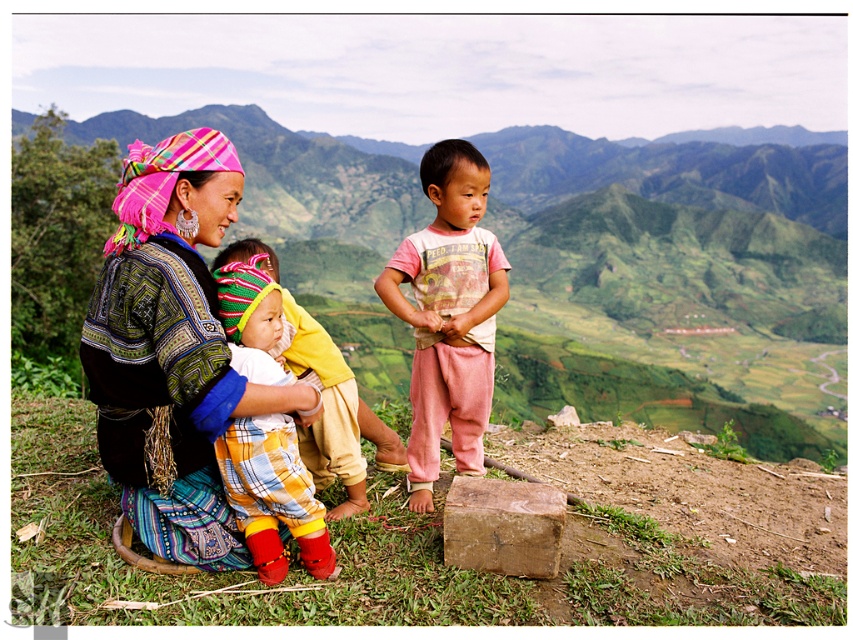
Which is above, matte black dress at center or pink cotton pants at center?

pink cotton pants at center

What do you see at coordinates (172, 352) in the screenshot? The image size is (853, 640). I see `matte black dress at center` at bounding box center [172, 352].

Image resolution: width=853 pixels, height=640 pixels. I want to click on matte black dress at center, so click(172, 352).

Is pink cotton pants at center thinner than brown rough stone at lower center?

No, pink cotton pants at center is not thinner than brown rough stone at lower center.

Does point (409, 456) lie in front of point (553, 566)?

No, it is not.

This screenshot has height=640, width=853. I want to click on pink cotton pants at center, so click(x=448, y=312).

In the scene shown: Which of these two, matte black dress at center or knitted woolen hat at center, stands taller?

Standing taller between the two is matte black dress at center.

Between matte black dress at center and knitted woolen hat at center, which one has less height?

knitted woolen hat at center is shorter.

Describe the element at coordinates (172, 352) in the screenshot. This screenshot has height=640, width=853. I see `matte black dress at center` at that location.

Image resolution: width=853 pixels, height=640 pixels. Find the location of `matte black dress at center`. matte black dress at center is located at coordinates (172, 352).